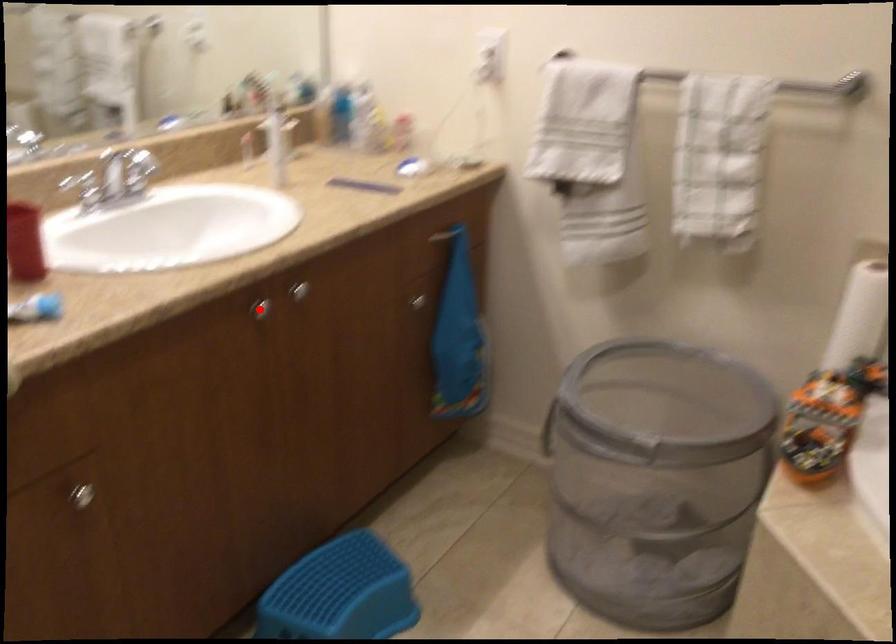
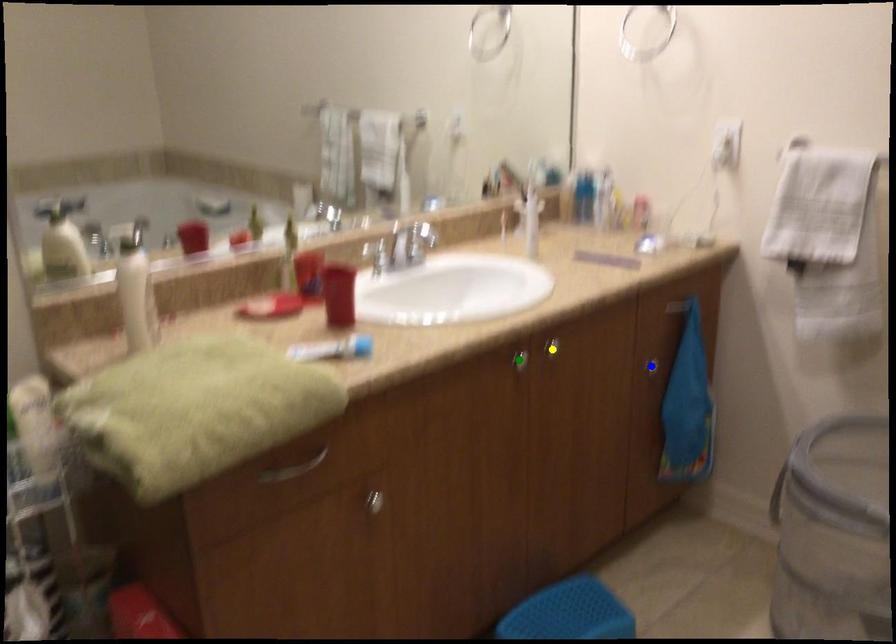
Question: I am providing you with two images of the same scene from different viewpoints. A red point is marked on the first image. You are given multiple points on the second image. In image 2, which mark is for the same physical point as the one in image 1?

Choices:
 (A) blue point
 (B) yellow point
 (C) green point

Answer: (C)